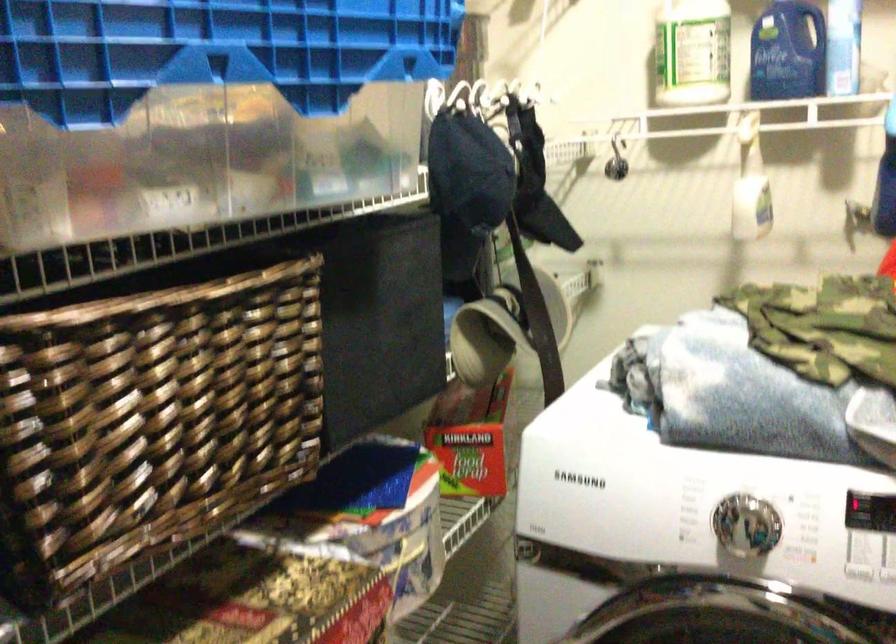
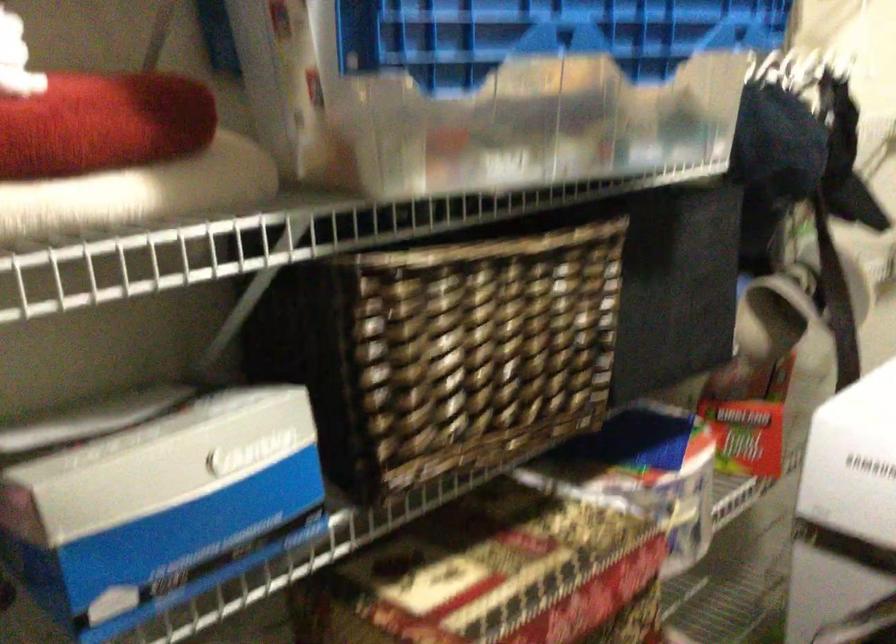
Question: Based on the continuous images, in which direction is the camera rotating? Reply with the corresponding letter.

Choices:
 (A) Left
 (B) Right
 (C) Up
 (D) Down

Answer: (A)